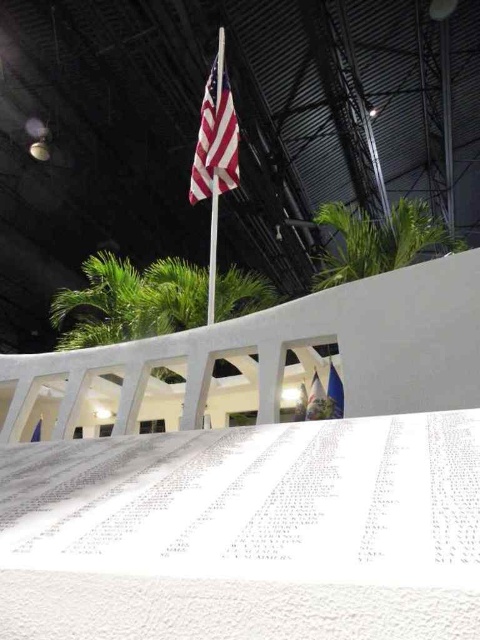
You are standing in the memorial space and want to take a photo of both the metallic silver flag pole at upper center and the blue fabric flag at center. Since the flag pole is taller, will it appear larger in your photo compared to the flag?

The metallic silver flag pole at upper center is taller than the blue fabric flag at center, so yes, it will appear larger in the photo.

You are standing in the memorial space and want to take a photo of both the green leafy palm tree at upper right and the metallic silver flag pole at upper center. Which object should you focus on first to ensure both are in the frame?

You should focus on the metallic silver flag pole at upper center first because the green leafy palm tree at upper right is closer to you, so adjusting the camera to include both would require framing starting from the closer object.